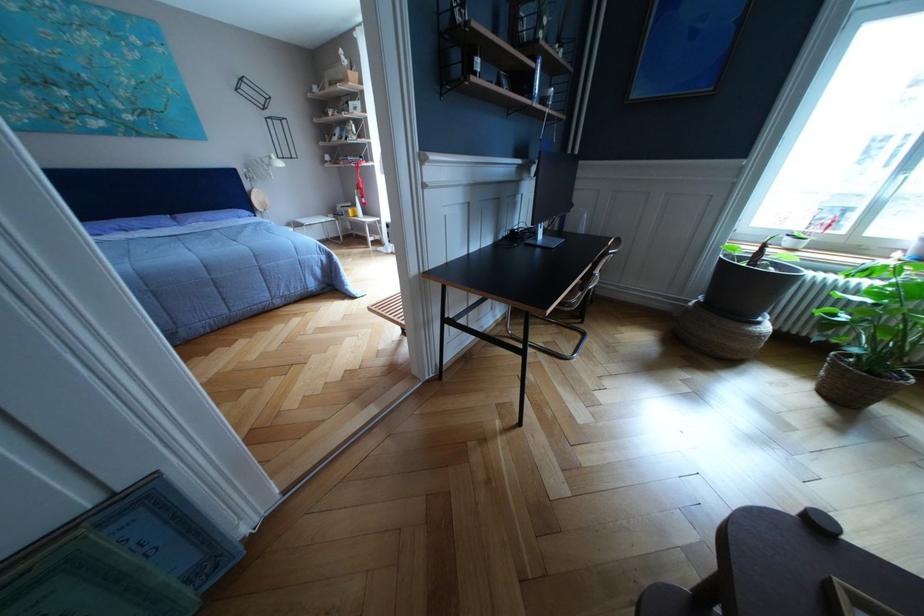
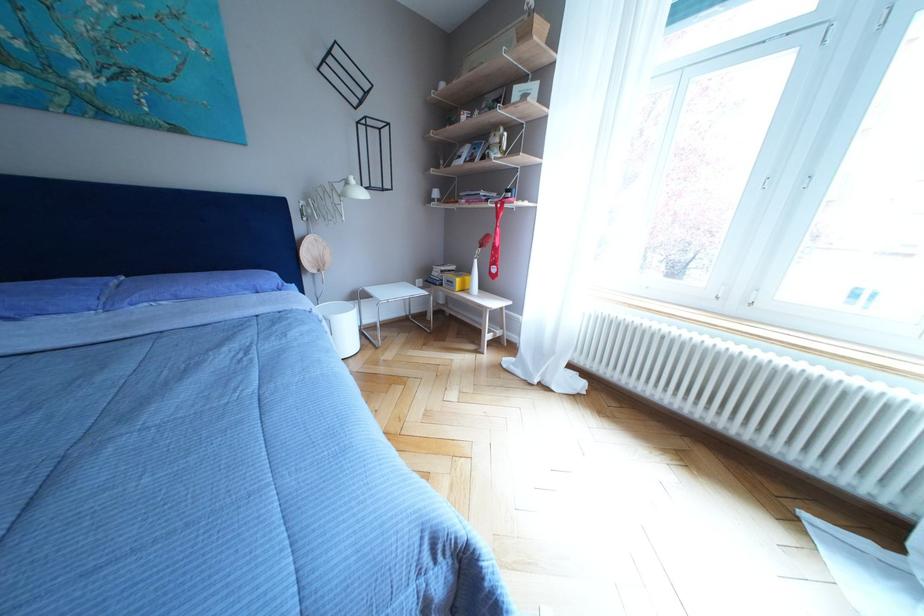
Find the pixel in the second image that matches the point at 256,201 in the first image.

(302, 251)